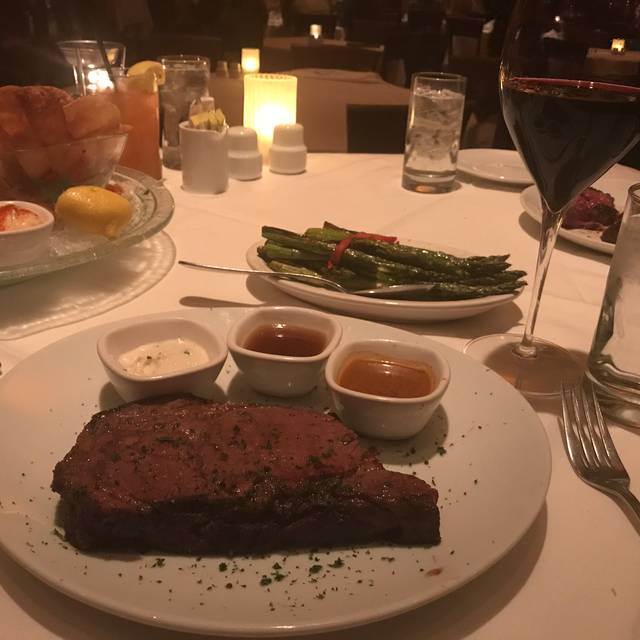
Identify the location of white plate. (497, 465).